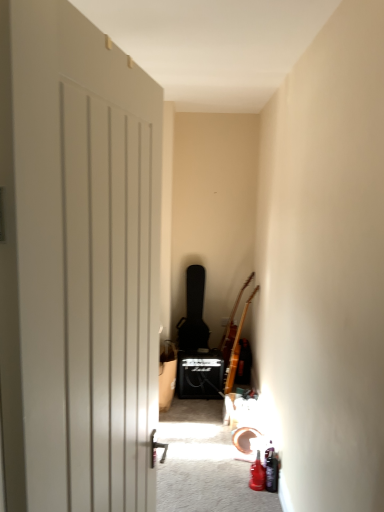
Question: Can you confirm if black matte guitar case at center, the third guitar in the right-to-left sequence, is shorter than brown wooden guitar at upper right, which is counted as the 2th guitar, starting from the left?

Choices:
 (A) no
 (B) yes

Answer: (A)

Question: Considering the relative positions of black matte guitar case at center, arranged as the first guitar when viewed from the left, and brown wooden guitar at upper right, which is counted as the 2th guitar, starting from the left, in the image provided, is black matte guitar case at center, arranged as the first guitar when viewed from the left, in front of brown wooden guitar at upper right, which is counted as the 2th guitar, starting from the left,?

Choices:
 (A) yes
 (B) no

Answer: (B)

Question: Is black matte guitar case at center, the third guitar in the right-to-left sequence, next to brown wooden guitar at upper right, which is counted as the 2th guitar, starting from the left, and touching it?

Choices:
 (A) no
 (B) yes

Answer: (A)

Question: From a real-world perspective, is black matte guitar case at center, arranged as the first guitar when viewed from the left, beneath brown wooden guitar at upper right, the second guitar when ordered from right to left?

Choices:
 (A) no
 (B) yes

Answer: (A)

Question: Could brown wooden guitar at upper right, which is counted as the 2th guitar, starting from the left, be considered to be inside black matte guitar case at center, the third guitar in the right-to-left sequence?

Choices:
 (A) yes
 (B) no

Answer: (B)

Question: Visually, is wooden acoustic guitar at right, positioned as the first guitar in right-to-left order, positioned to the left or to the right of brown wooden guitar at upper right, the second guitar when ordered from right to left?

Choices:
 (A) left
 (B) right

Answer: (B)

Question: Considering their positions, is wooden acoustic guitar at right, positioned as the first guitar in right-to-left order, located in front of or behind brown wooden guitar at upper right, the second guitar when ordered from right to left?

Choices:
 (A) front
 (B) behind

Answer: (A)

Question: Is wooden acoustic guitar at right, positioned as the first guitar in right-to-left order, inside the boundaries of brown wooden guitar at upper right, which is counted as the 2th guitar, starting from the left, or outside?

Choices:
 (A) inside
 (B) outside

Answer: (B)

Question: From the image's perspective, is wooden acoustic guitar at right, which is the 3th guitar in left-to-right order, above or below brown wooden guitar at upper right, the second guitar when ordered from right to left?

Choices:
 (A) above
 (B) below

Answer: (B)

Question: Visually, is brown wooden guitar at upper right, the second guitar when ordered from right to left, positioned to the left or to the right of wooden acoustic guitar at right, which is the 3th guitar in left-to-right order?

Choices:
 (A) right
 (B) left

Answer: (B)

Question: From the image's perspective, is brown wooden guitar at upper right, the second guitar when ordered from right to left, above or below wooden acoustic guitar at right, which is the 3th guitar in left-to-right order?

Choices:
 (A) above
 (B) below

Answer: (A)

Question: Looking at their shapes, would you say brown wooden guitar at upper right, the second guitar when ordered from right to left, is wider or thinner than wooden acoustic guitar at right, positioned as the first guitar in right-to-left order?

Choices:
 (A) wide
 (B) thin

Answer: (A)

Question: From a real-world perspective, is brown wooden guitar at upper right, which is counted as the 2th guitar, starting from the left, positioned above or below wooden acoustic guitar at right, which is the 3th guitar in left-to-right order?

Choices:
 (A) below
 (B) above

Answer: (B)

Question: In the image, is wooden acoustic guitar at right, which is the 3th guitar in left-to-right order, positioned in front of or behind black matte guitar case at center, the third guitar in the right-to-left sequence?

Choices:
 (A) behind
 (B) front

Answer: (B)

Question: Is wooden acoustic guitar at right, which is the 3th guitar in left-to-right order, situated inside black matte guitar case at center, arranged as the first guitar when viewed from the left, or outside?

Choices:
 (A) inside
 (B) outside

Answer: (B)